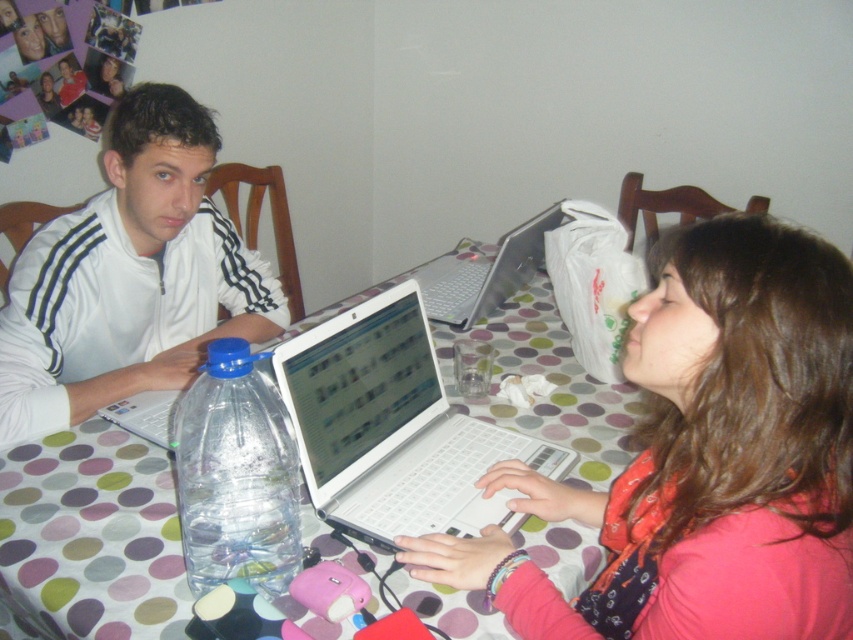
Does polka dot fabric table at center have a smaller size compared to white plastic laptop at center?

Incorrect, polka dot fabric table at center is not smaller in size than white plastic laptop at center.

Is polka dot fabric table at center wider than white plastic laptop at center?

Indeed, polka dot fabric table at center has a greater width compared to white plastic laptop at center.

Is point (628, 413) positioned behind point (390, 529)?

Yes, it is.

Locate an element on the screen. polka dot fabric table at center is located at coordinates (94, 532).

Does white matte jacket at upper left appear over clear plastic bottle at center?

Correct, white matte jacket at upper left is located above clear plastic bottle at center.

Between white matte jacket at upper left and clear plastic bottle at center, which one has more height?

Standing taller between the two is white matte jacket at upper left.

Identify the location of white matte jacket at upper left. Image resolution: width=853 pixels, height=640 pixels. (129, 276).

Can you confirm if polka dot fabric table at center is taller than white glossy laptop at center?

Correct, polka dot fabric table at center is much taller as white glossy laptop at center.

Is polka dot fabric table at center shorter than white glossy laptop at center?

In fact, polka dot fabric table at center may be taller than white glossy laptop at center.

Is point (490, 390) positioned behind point (537, 253)?

No, it is not.

Where is `polka dot fabric table at center`? The image size is (853, 640). polka dot fabric table at center is located at coordinates (94, 532).